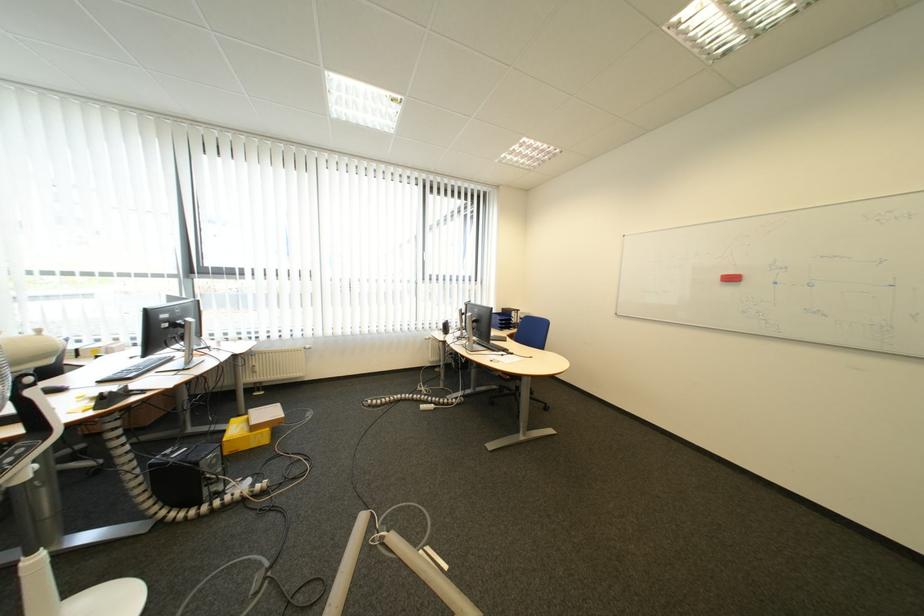
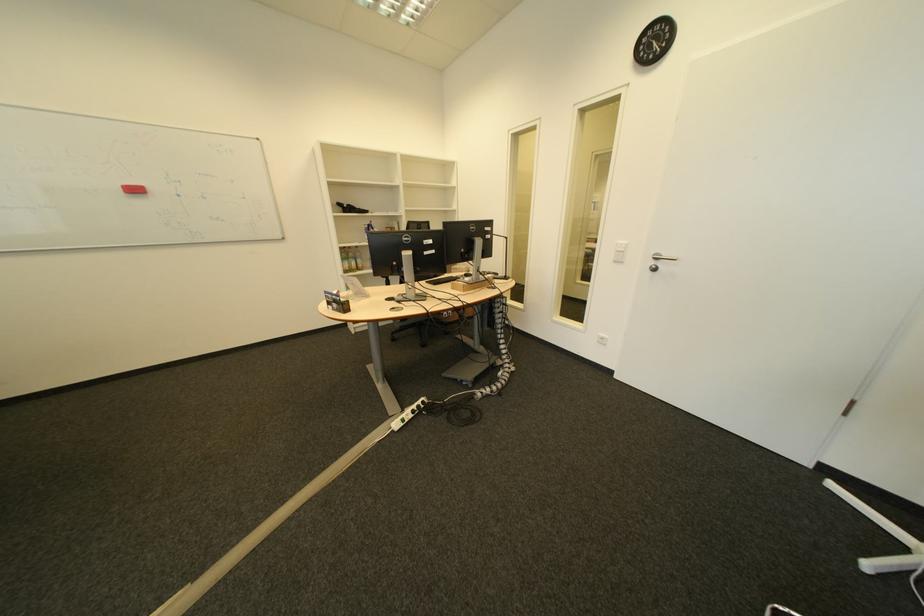
The point at [788,285] is marked in the first image. Where is the corresponding point in the second image?

(192, 197)